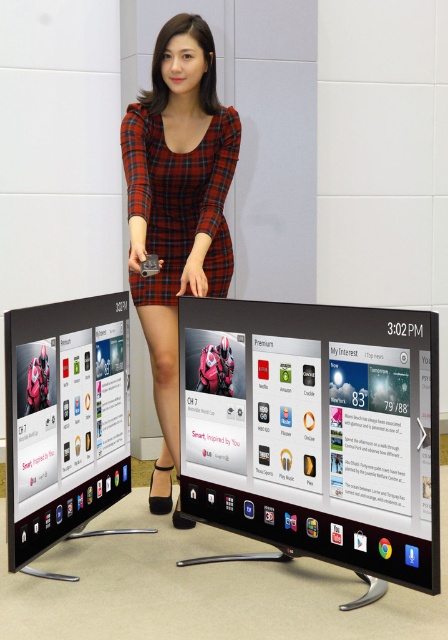
Which is more to the right, black glossy screen at center or red plaid dress at center?

black glossy screen at center

Can you confirm if black glossy screen at center is smaller than red plaid dress at center?

Correct, black glossy screen at center occupies less space than red plaid dress at center.

You are a GUI agent. You are given a task and a screenshot of the screen. Output one action in this format:
    pyautogui.click(x=<x>, y=<y>)
    Task: Click on the black glossy screen at center
    The width and height of the screenshot is (448, 640).
    Given the screenshot: What is the action you would take?
    pyautogui.click(x=314, y=432)

At what (x,y) coordinates should I click in order to perform the action: click on black glossy screen at center. Please return your answer as a coordinate pair (x, y). Looking at the image, I should click on (314, 432).

Who is more distant from viewer, [169,129] or [16,429]?

The point [169,129] is behind.

Is red plaid dress at center below matte black screen at center?

No.

Which is behind, point (218, 177) or point (37, 340)?

The point (218, 177) is behind.

Where is `red plaid dress at center`? red plaid dress at center is located at coordinates (176, 209).

Can you confirm if matte black screen at center is thinner than plaid fabric dress at center?

Correct, matte black screen at center's width is less than plaid fabric dress at center's.

Does matte black screen at center have a greater height compared to plaid fabric dress at center?

Indeed, matte black screen at center has a greater height compared to plaid fabric dress at center.

You are a GUI agent. You are given a task and a screenshot of the screen. Output one action in this format:
    pyautogui.click(x=<x>, y=<y>)
    Task: Click on the matte black screen at center
    The width and height of the screenshot is (448, 640).
    Given the screenshot: What is the action you would take?
    pyautogui.click(x=64, y=419)